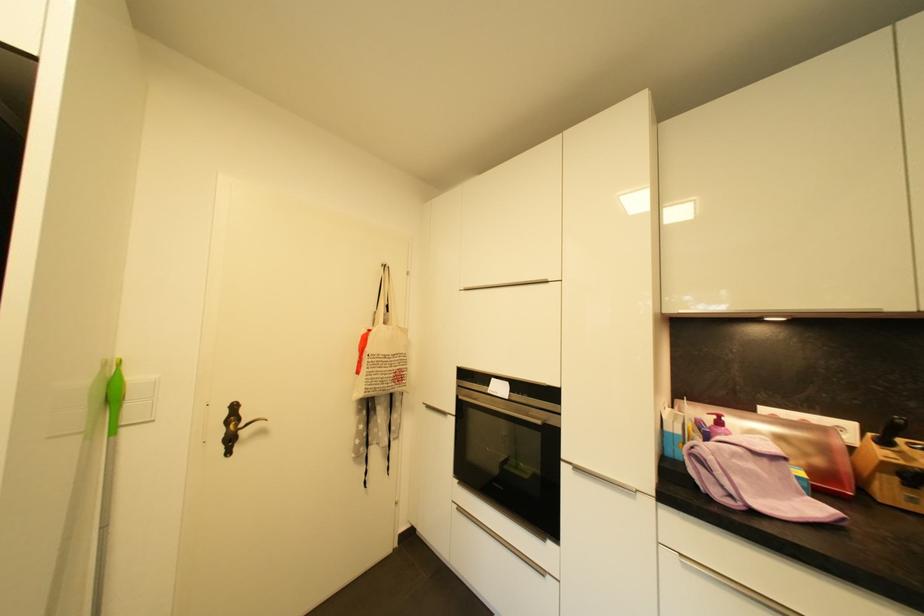
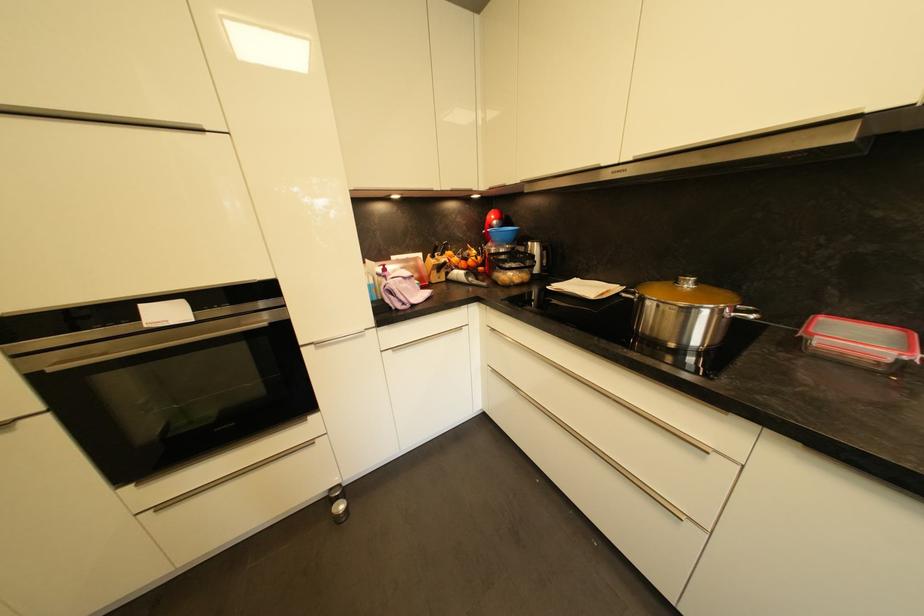
From the picture: Based on the continuous images, in which direction is the camera rotating?

The camera's rotation is toward right-down.